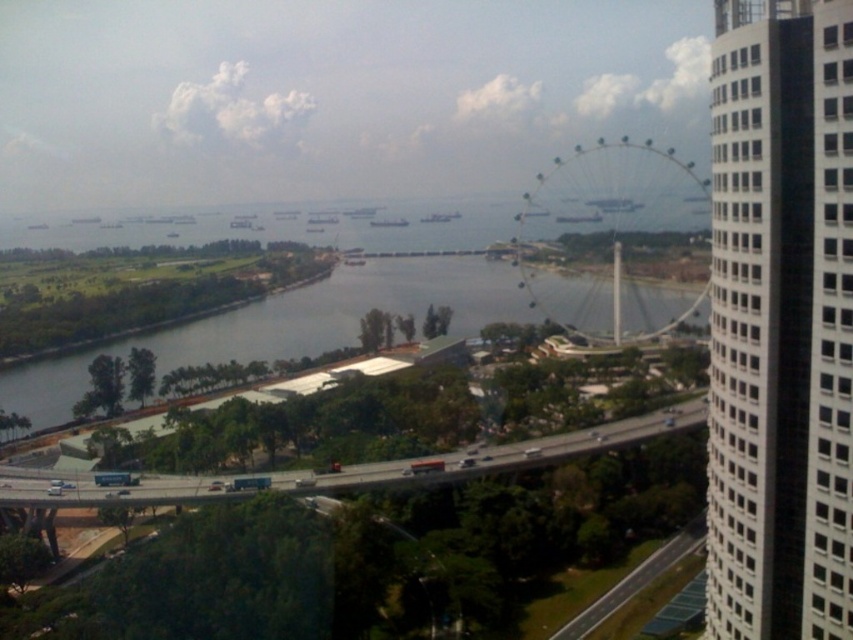
You are standing at the edge of the green grass at lower left and want to take a photo of the metallic silver ferris wheel at center. Which object is closer to you when you take the photo?

The green grass at lower left is closer to you when taking the photo because it is in the foreground, while the metallic silver ferris wheel at center is further away.

You are standing at the viewpoint where the image was taken. There are two points marked in the scene, one at coordinates point (809, 474) and another at point (30, 388). Which point is closer to your current position?

Point (809, 474) is closer to the viewer than point (30, 388).